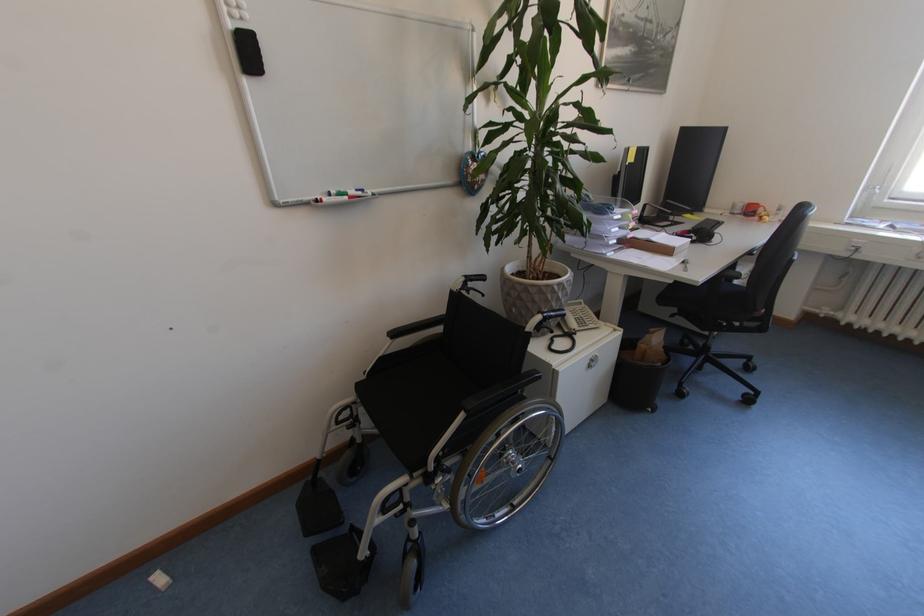
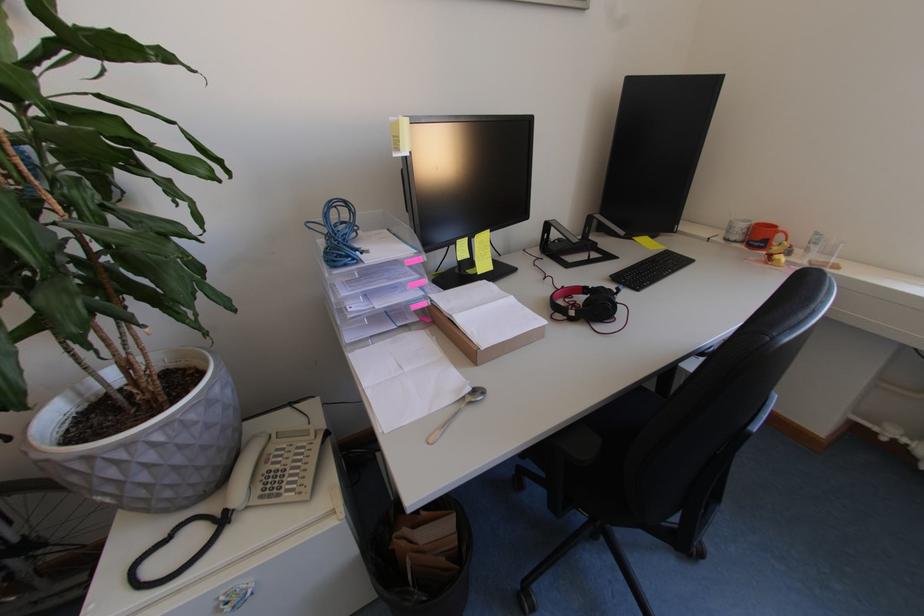
Where in the second image is the point corresponding to the point at 715,221 from the first image?

(674, 254)